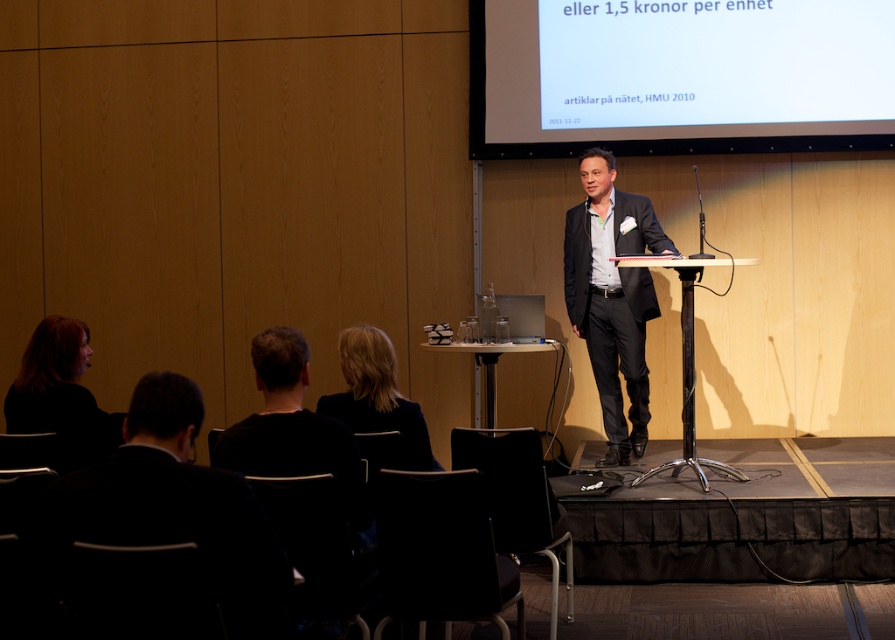
Which of these two, black leather chair at lower left or metallic silver chair at lower center, stands shorter?

With less height is metallic silver chair at lower center.

Is point (109, 563) in front of point (365, 472)?

Yes, it is in front of point (365, 472).

In order to click on black leather chair at lower left in this screenshot , I will do `click(143, 593)`.

Find the location of a particular element. black leather chair at lower left is located at coordinates (143, 593).

Who is lower down, black suit at lower left or black leather chair at lower center?

Positioned lower is black leather chair at lower center.

Between point (237, 580) and point (457, 541), which one is positioned in front?

Positioned in front is point (237, 580).

At what (x,y) coordinates should I click in order to perform the action: click on black suit at lower left. Please return your answer as a coordinate pair (x, y). The height and width of the screenshot is (640, 895). Looking at the image, I should click on (179, 506).

In the scene shown: Is black suit at lower left to the left of black plastic chair at lower center from the viewer's perspective?

Indeed, black suit at lower left is positioned on the left side of black plastic chair at lower center.

Does point (274, 636) come farther from viewer compared to point (508, 474)?

No, it is not.

Who is more forward, [139,472] or [542,476]?

Point [139,472] is more forward.

In order to click on black suit at lower left in this screenshot , I will do `click(179, 506)`.